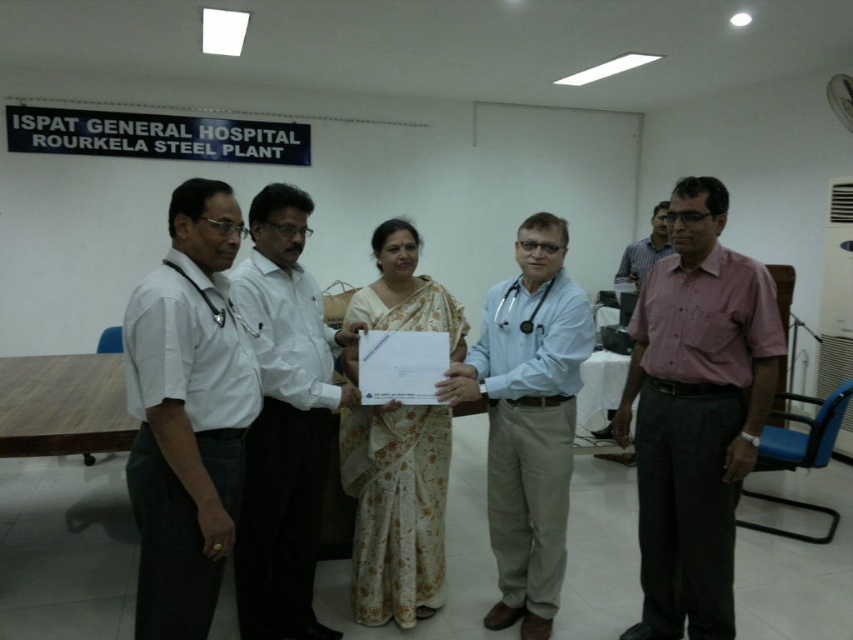
Looking at this image, in the scene at ISPAT General Hospital, you notice a white shirt at left and a white floral saree at center. Which of these two items is larger in size?

The white floral saree at center is larger than the white shirt at left.

You are a photographer standing in the room and want to take a photo that includes both the light blue shirt at center and the white floral saree at center. Which one should you focus on first if you want to ensure both are in focus?

The light blue shirt at center has a greater height compared to white floral saree at center, so you should focus on the light blue shirt at center first to ensure both are in focus.